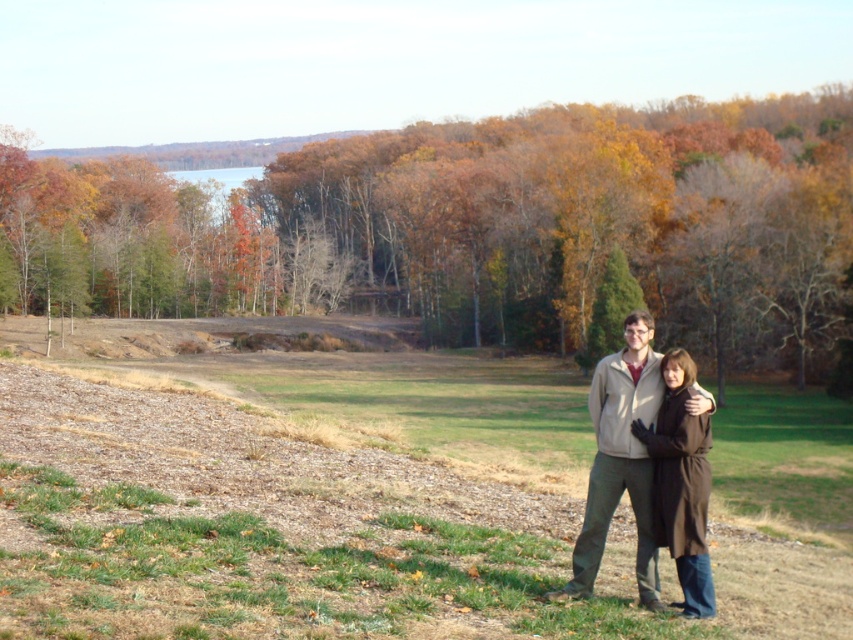
Is brown matte tree at center to the left of beige fleece jacket at center from the viewer's perspective?

Correct, you'll find brown matte tree at center to the left of beige fleece jacket at center.

Does brown matte tree at center appear on the right side of beige fleece jacket at center?

In fact, brown matte tree at center is to the left of beige fleece jacket at center.

What are the coordinates of `brown matte tree at center` in the screenshot? It's located at point(482,228).

At what (x,y) coordinates should I click in order to perform the action: click on brown matte tree at center. Please return your answer as a coordinate pair (x, y). The height and width of the screenshot is (640, 853). Looking at the image, I should click on (482, 228).

Is point (647, 176) closer to camera compared to point (708, 444)?

No, (647, 176) is further to viewer.

Image resolution: width=853 pixels, height=640 pixels. What do you see at coordinates (482, 228) in the screenshot?
I see `brown matte tree at center` at bounding box center [482, 228].

Does point (844, 333) come behind point (693, 548)?

Yes, point (844, 333) is behind point (693, 548).

Locate an element on the screen. The image size is (853, 640). brown matte tree at center is located at coordinates (482, 228).

Between beige fleece jacket at center and brown wool coat at lower right, which one has less height?

brown wool coat at lower right

Is point (635, 490) positioned before point (654, 449)?

No, (635, 490) is behind (654, 449).

At what (x,y) coordinates should I click in order to perform the action: click on beige fleece jacket at center. Please return your answer as a coordinate pair (x, y). The width and height of the screenshot is (853, 640). Looking at the image, I should click on (619, 460).